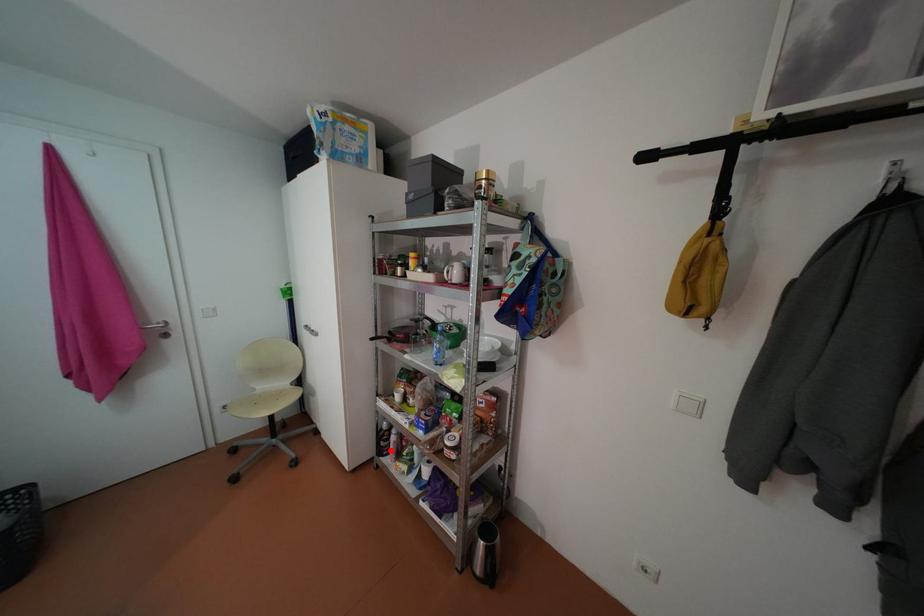
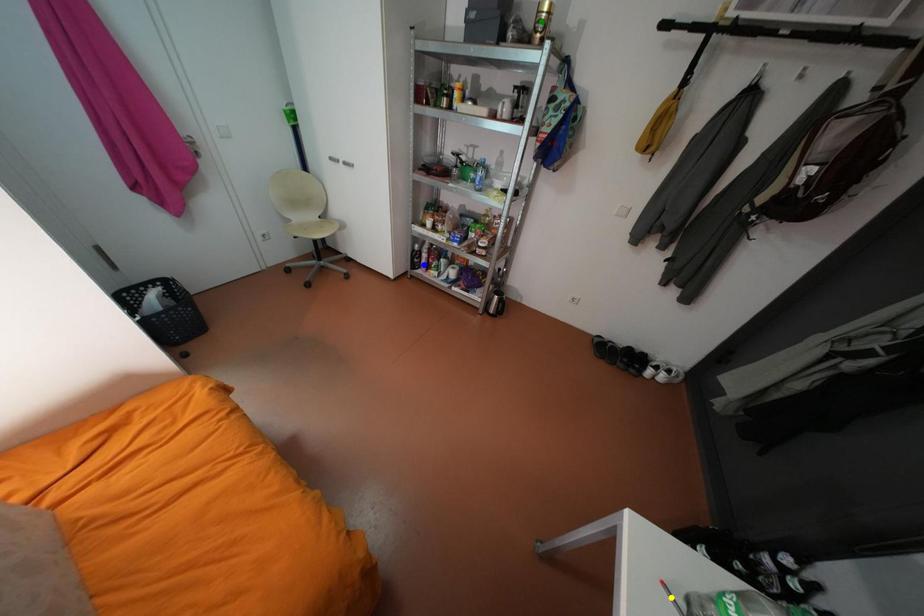
Question: I am providing you with two images of the same scene from different viewpoints. A red point is marked on the first image. You are given multiple points on the second image. Which point in image 2 represents the same 3d spot as the red point in image 1?

Choices:
 (A) blue point
 (B) yellow point
 (C) green point

Answer: (A)